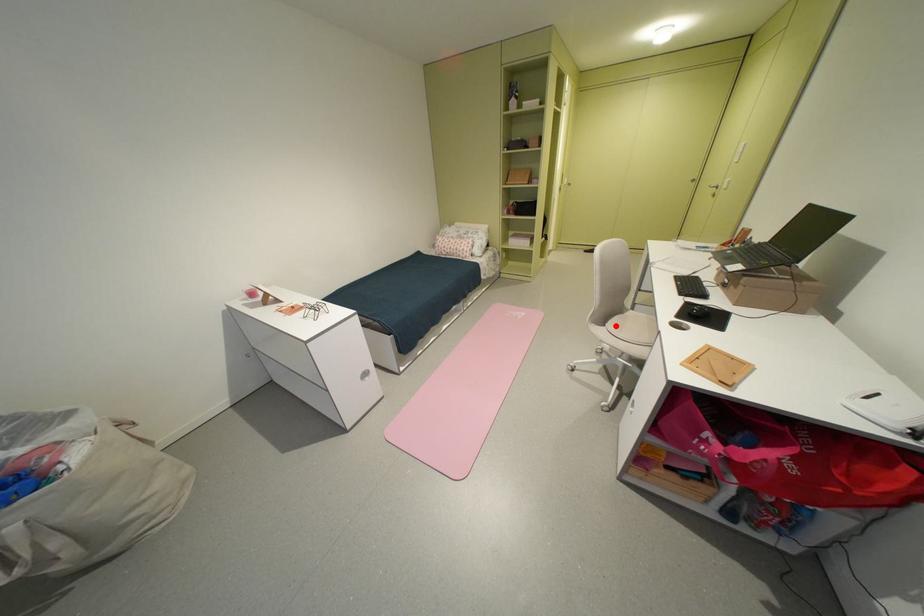
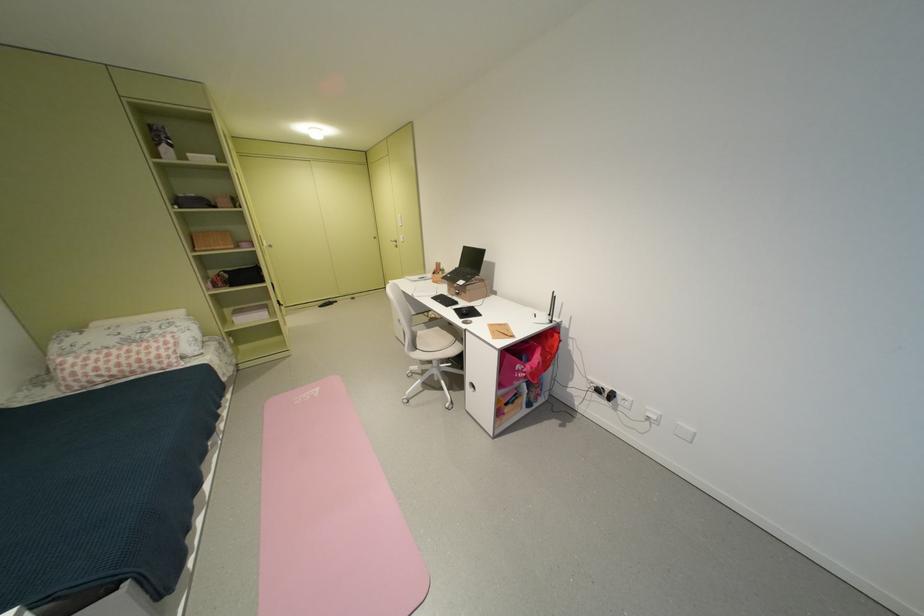
The point at the highlighted location is marked in the first image. Where is the corresponding point in the second image?

(428, 349)